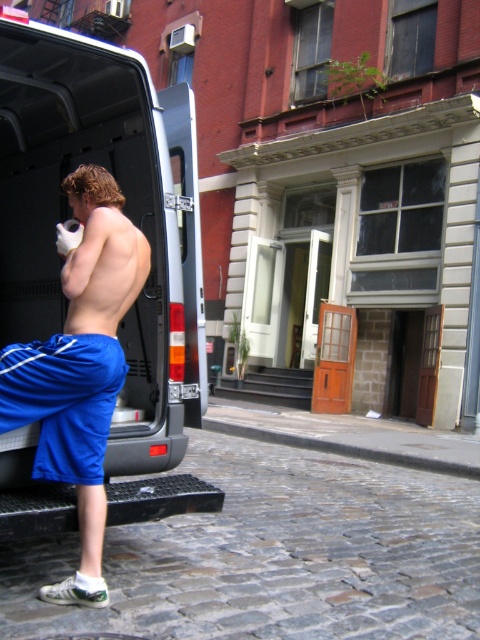
Question: Is white matte van at center closer to the viewer compared to blue fabric shorts at center?

Choices:
 (A) no
 (B) yes

Answer: (A)

Question: In this image, where is blue fabric shorts at center located relative to blue fabric shorts at lower left?

Choices:
 (A) left
 (B) right

Answer: (B)

Question: From the image, what is the correct spatial relationship of white matte van at center in relation to blue fabric shorts at lower left?

Choices:
 (A) left
 (B) right

Answer: (A)

Question: Which object appears farthest from the camera in this image?

Choices:
 (A) blue fabric shorts at center
 (B) white matte van at center

Answer: (B)

Question: Based on their relative distances, which object is nearer to the blue fabric shorts at lower left?

Choices:
 (A) blue fabric shorts at center
 (B) white matte van at center

Answer: (A)

Question: Among these objects, which one is farthest from the camera?

Choices:
 (A) blue fabric shorts at center
 (B) white matte van at center
 (C) blue fabric shorts at lower left

Answer: (B)